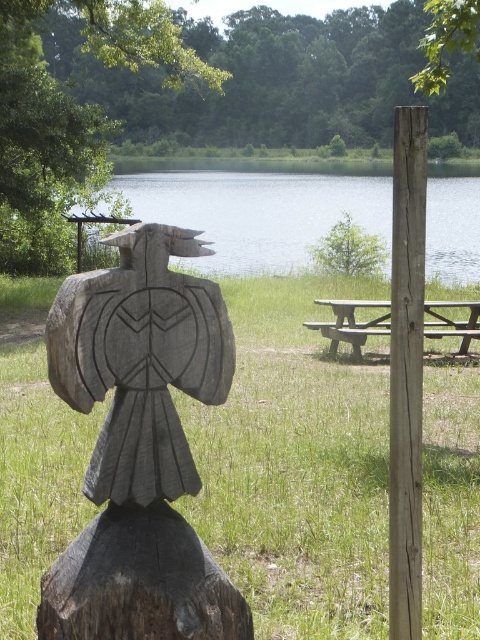
Does carved stone bird at center appear on the left side of dark wood carving at center?

Yes, carved stone bird at center is to the left of dark wood carving at center.

Does carved stone bird at center have a lesser height compared to dark wood carving at center?

In fact, carved stone bird at center may be taller than dark wood carving at center.

Is point (71, 289) positioned behind point (177, 545)?

No, it is not.

Where is `carved stone bird at center`? This screenshot has width=480, height=640. carved stone bird at center is located at coordinates (141, 360).

Which is more to the right, carved stone bird at center or smooth wood post at right?

Positioned to the right is smooth wood post at right.

Does carved stone bird at center appear on the left side of smooth wood post at right?

Yes, carved stone bird at center is to the left of smooth wood post at right.

The image size is (480, 640). What are the coordinates of `carved stone bird at center` in the screenshot? It's located at (141, 360).

Locate an element on the screen. Image resolution: width=480 pixels, height=640 pixels. carved stone bird at center is located at coordinates (141, 360).

At what (x,y) coordinates should I click in order to perform the action: click on green rough grass at center. Please return your answer as a coordinate pair (x, y). The height and width of the screenshot is (640, 480). Looking at the image, I should click on (297, 465).

Who is positioned more to the right, green rough grass at center or green wood tree at upper center?

From the viewer's perspective, green rough grass at center appears more on the right side.

Describe the element at coordinates (297, 465) in the screenshot. I see `green rough grass at center` at that location.

You are a GUI agent. You are given a task and a screenshot of the screen. Output one action in this format:
    pyautogui.click(x=<x>, y=<y>)
    Task: Click on the green rough grass at center
    The image size is (480, 640).
    Given the screenshot: What is the action you would take?
    pyautogui.click(x=297, y=465)